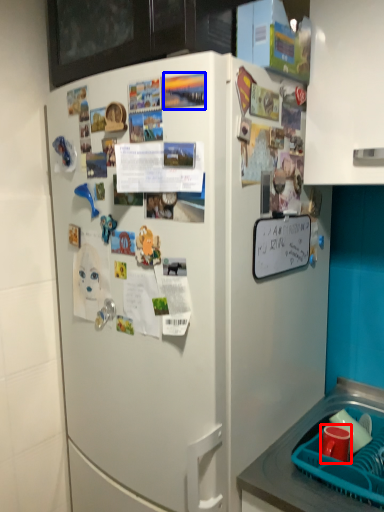
Question: Which object is further to the camera taking this photo, coffee cup (highlighted by a red box) or poster (highlighted by a blue box)?

Choices:
 (A) coffee cup
 (B) poster

Answer: (A)